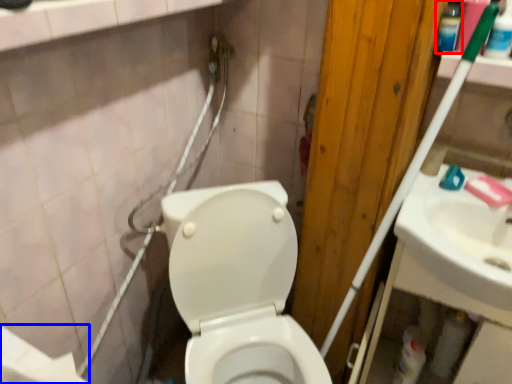
Question: Which of the following is the closest to the observer, mouthwash (highlighted by a red box) or toilet paper (highlighted by a blue box)?

Choices:
 (A) mouthwash
 (B) toilet paper

Answer: (B)